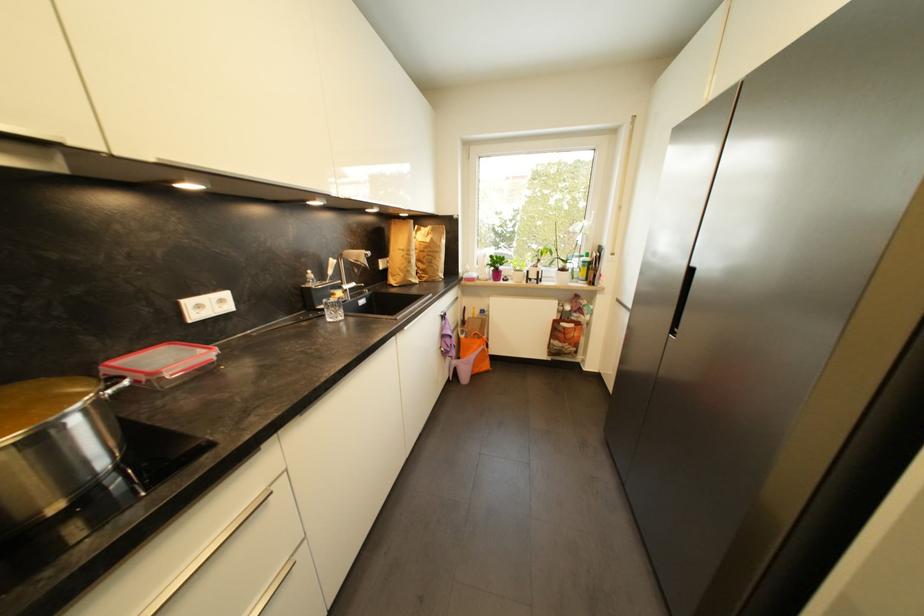
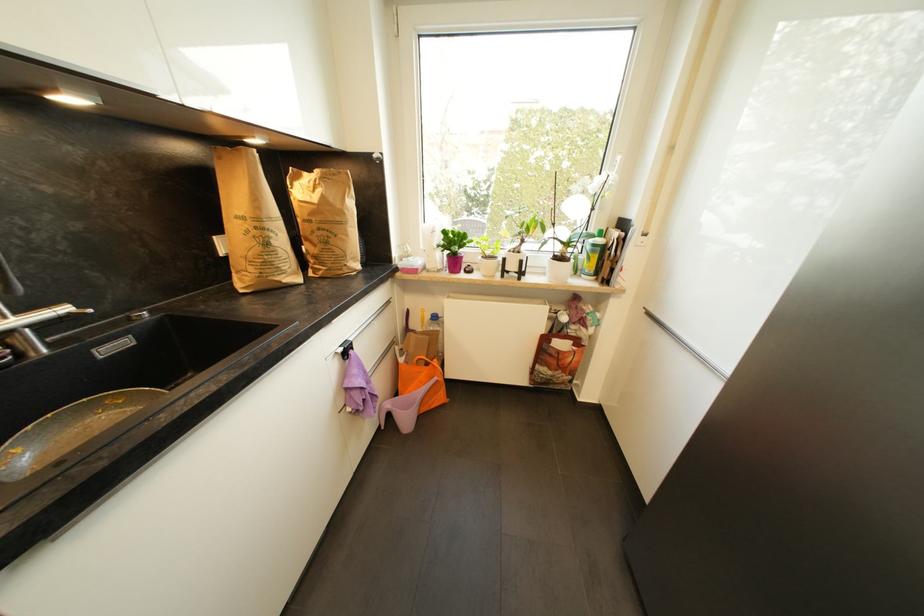
Question: I am providing you with two images of the same scene from different viewpoints. Which of the following objects are not visible in image2?

Choices:
 (A) window blind bar
 (B) blue water bottle
 (C) metal faucet handle
 (D) none of these

Answer: (D)